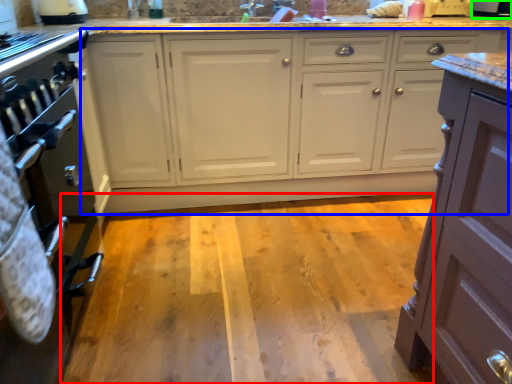
Question: Considering the real-world distances, which object is closest to plain (highlighted by a red box)? cabinetry (highlighted by a blue box) or appliance (highlighted by a green box).

Choices:
 (A) cabinetry
 (B) appliance

Answer: (A)